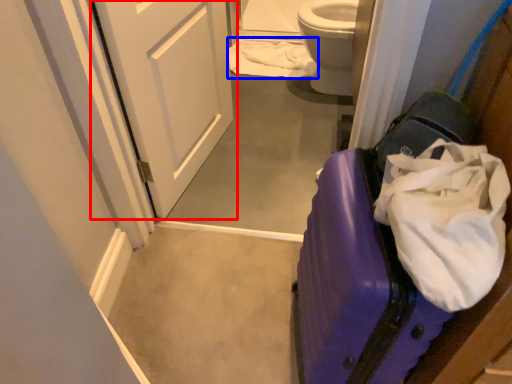
Question: Which object is closer to the camera taking this photo, door (highlighted by a red box) or toilet paper (highlighted by a blue box)?

Choices:
 (A) door
 (B) toilet paper

Answer: (A)